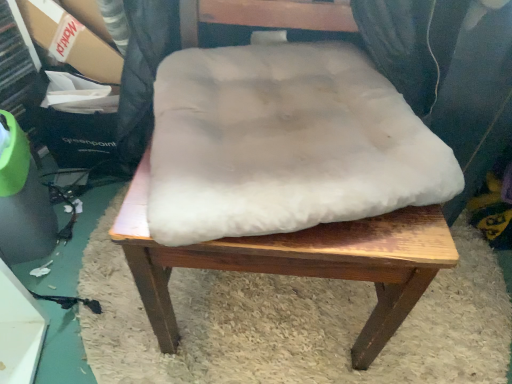
Question: Considering the relative sizes of white fluffy cushion at center and white fluffy cushion at center in the image provided, is white fluffy cushion at center thinner than white fluffy cushion at center?

Choices:
 (A) no
 (B) yes

Answer: (B)

Question: Can you confirm if white fluffy cushion at center is shorter than white fluffy cushion at center?

Choices:
 (A) yes
 (B) no

Answer: (B)

Question: From a real-world perspective, does white fluffy cushion at center stand above white fluffy cushion at center?

Choices:
 (A) no
 (B) yes

Answer: (B)

Question: Does white fluffy cushion at center lie behind white fluffy cushion at center?

Choices:
 (A) no
 (B) yes

Answer: (A)

Question: From the image's perspective, is white fluffy cushion at center on top of white fluffy cushion at center?

Choices:
 (A) no
 (B) yes

Answer: (B)

Question: From a real-world perspective, is white fluffy cushion at center positioned above or below white fluffy cushion at center?

Choices:
 (A) below
 (B) above

Answer: (A)

Question: From the image's perspective, relative to white fluffy cushion at center, is white fluffy cushion at center above or below?

Choices:
 (A) above
 (B) below

Answer: (B)

Question: Is point (242, 258) positioned closer to the camera than point (334, 215)?

Choices:
 (A) farther
 (B) closer

Answer: (A)

Question: Is white fluffy cushion at center inside or outside of white fluffy cushion at center?

Choices:
 (A) inside
 (B) outside

Answer: (B)

Question: In the image, is white fluffy cushion at center on the left side or the right side of white fluffy cushion at center?

Choices:
 (A) left
 (B) right

Answer: (B)

Question: From a real-world perspective, is white fluffy cushion at center positioned above or below white fluffy cushion at center?

Choices:
 (A) above
 (B) below

Answer: (B)

Question: In the image, is white fluffy cushion at center positioned in front of or behind white fluffy cushion at center?

Choices:
 (A) front
 (B) behind

Answer: (B)

Question: Is white fluffy cushion at center spatially inside white fluffy cushion at center, or outside of it?

Choices:
 (A) outside
 (B) inside

Answer: (A)

Question: Does point (x=193, y=110) appear closer or farther from the camera than point (x=165, y=306)?

Choices:
 (A) farther
 (B) closer

Answer: (B)

Question: In the image, is white fluffy cushion at center positioned in front of or behind white fluffy cushion at center?

Choices:
 (A) behind
 (B) front

Answer: (A)